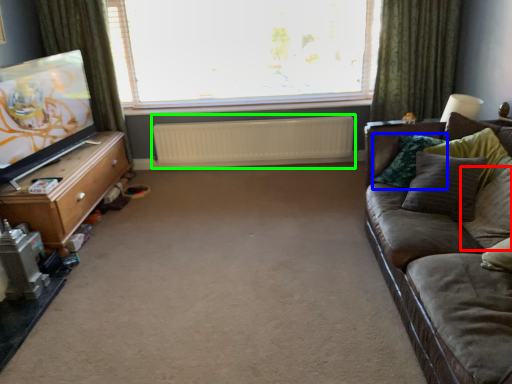
Question: Which object is the farthest from pillow (highlighted by a red box)? Choose among these: pillow (highlighted by a blue box) or radiator (highlighted by a green box).

Choices:
 (A) pillow
 (B) radiator

Answer: (B)